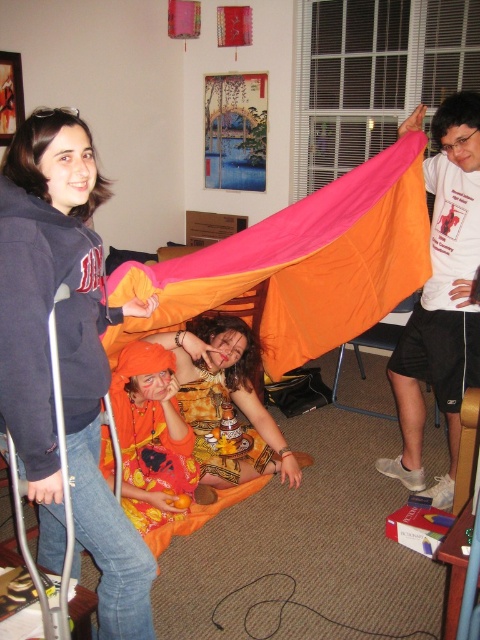
Can you confirm if pink fabric tent at center is thinner than orange fabric at center?

In fact, pink fabric tent at center might be wider than orange fabric at center.

Can you confirm if pink fabric tent at center is positioned to the left of orange fabric at center?

No, pink fabric tent at center is not to the left of orange fabric at center.

What do you see at coordinates (300, 264) in the screenshot? I see `pink fabric tent at center` at bounding box center [300, 264].

Image resolution: width=480 pixels, height=640 pixels. I want to click on pink fabric tent at center, so click(300, 264).

Is matte black hoodie at left smaller than pink fabric tent at center?

A: Yes, matte black hoodie at left is smaller than pink fabric tent at center.

The image size is (480, 640). I want to click on matte black hoodie at left, so click(64, 356).

Which is behind, point (79, 208) or point (163, 500)?

The point (163, 500) is behind.

Between point (121, 570) and point (168, 356), which one is positioned in front?

Point (121, 570) is in front.

Is point (41, 301) positioned in front of point (168, 401)?

Yes, it is.

Identify the location of matte black hoodie at left. Image resolution: width=480 pixels, height=640 pixels. (64, 356).